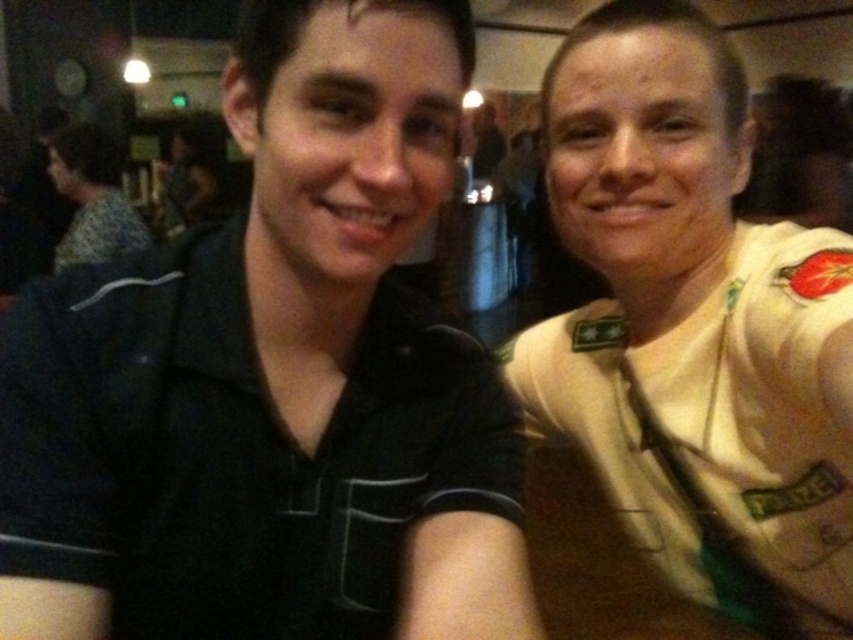
You are standing in a dimly lit indoor space, possibly a bar or restaurant, and there is a point at coordinates (479, 410) in the scene. If you want to touch this point with a 12.5 inch long stick, can you reach it?

The point at (479, 410) is 26.13 inches away from the viewer. Since the stick is only 12.5 inches long, you cannot reach it with the stick.

You are a photographer adjusting the camera height to ensure both the black matte shirt at center and the white uniform shirt at right are fully visible in the frame. Which shirt should you focus on to set the correct height?

The black matte shirt at center is shorter than the white uniform shirt at right, so you should focus on the white uniform shirt at right to set the correct height since it is taller and requires the camera to be positioned higher to capture both fully.